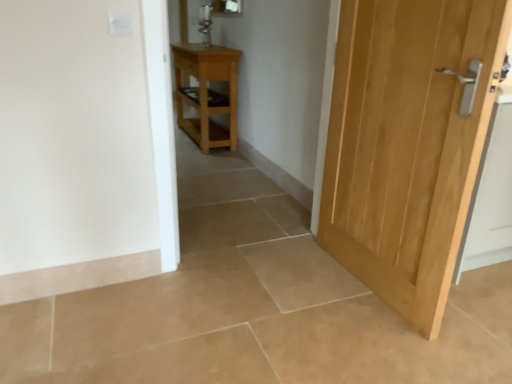
Question: Is natural wood door at right surrounding light brown wood nightstand at center?

Choices:
 (A) no
 (B) yes

Answer: (A)

Question: Is natural wood door at right oriented away from light brown wood nightstand at center?

Choices:
 (A) yes
 (B) no

Answer: (B)

Question: Is natural wood door at right not inside light brown wood nightstand at center?

Choices:
 (A) yes
 (B) no

Answer: (A)

Question: Does natural wood door at right have a smaller size compared to light brown wood nightstand at center?

Choices:
 (A) no
 (B) yes

Answer: (B)

Question: Is the position of natural wood door at right more distant than that of light brown wood nightstand at center?

Choices:
 (A) no
 (B) yes

Answer: (A)

Question: Can you confirm if natural wood door at right is positioned to the right of light brown wood nightstand at center?

Choices:
 (A) yes
 (B) no

Answer: (A)

Question: Considering the relative sizes of light brown wood nightstand at center and natural wood door at right in the image provided, is light brown wood nightstand at center smaller than natural wood door at right?

Choices:
 (A) yes
 (B) no

Answer: (B)

Question: From a real-world perspective, is light brown wood nightstand at center below natural wood door at right?

Choices:
 (A) no
 (B) yes

Answer: (B)

Question: Can you confirm if light brown wood nightstand at center is wider than natural wood door at right?

Choices:
 (A) no
 (B) yes

Answer: (B)

Question: Is light brown wood nightstand at center thinner than natural wood door at right?

Choices:
 (A) no
 (B) yes

Answer: (A)

Question: From the image's perspective, is light brown wood nightstand at center above natural wood door at right?

Choices:
 (A) no
 (B) yes

Answer: (B)

Question: Is light brown wood nightstand at center looking in the opposite direction of natural wood door at right?

Choices:
 (A) no
 (B) yes

Answer: (A)

Question: Is light brown wood nightstand at center in front of or behind natural wood door at right in the image?

Choices:
 (A) behind
 (B) front

Answer: (A)